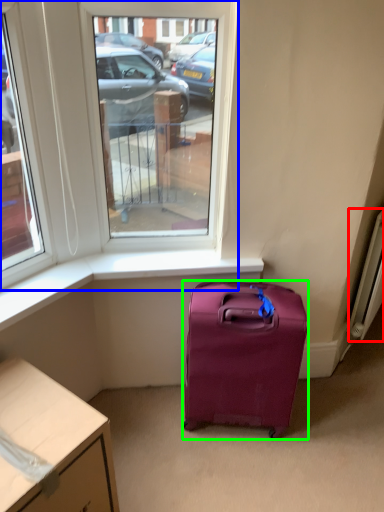
Question: Which object is positioned closest to radiator (highlighted by a red box)? Select from window (highlighted by a blue box) and luggage and bags (highlighted by a green box).

Choices:
 (A) window
 (B) luggage and bags

Answer: (B)